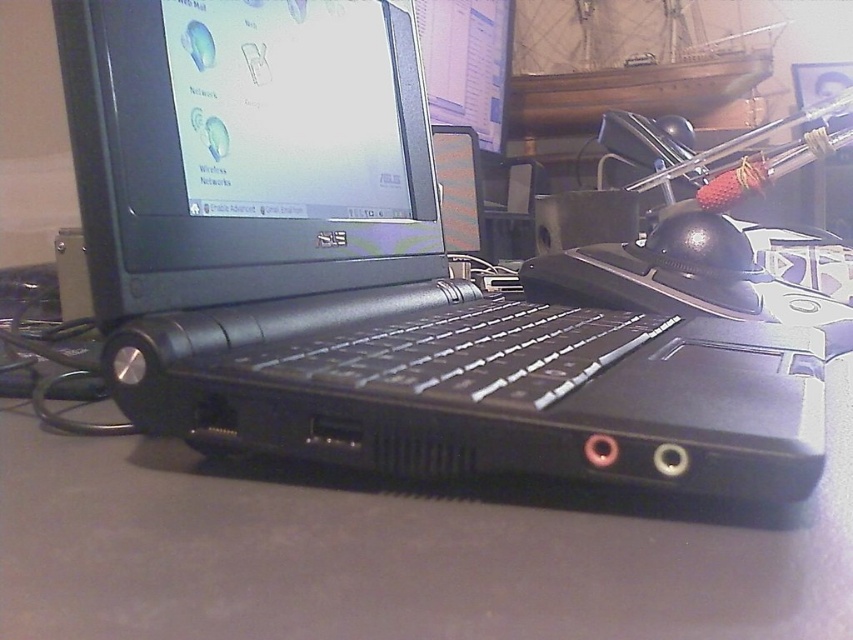
You are trying to place a new mousepad between the black plastic laptop at center and the black matte keyboard at center. Based on their positions, where should the mousepad be placed?

The black plastic laptop at center is located above the black matte keyboard at center, so the mousepad should be placed below the black matte keyboard at center to accommodate their vertical arrangement.

You are trying to determine the relative depth of two points in the image. Given that you are looking at the ASUS laptop and the decorative ship to its right, can you tell which of the two points, point (144, 349) or point (412, 381), is closer to you?

Point (144, 349) is further to the viewer than point (412, 381), so point (144, 349) is closer to you.